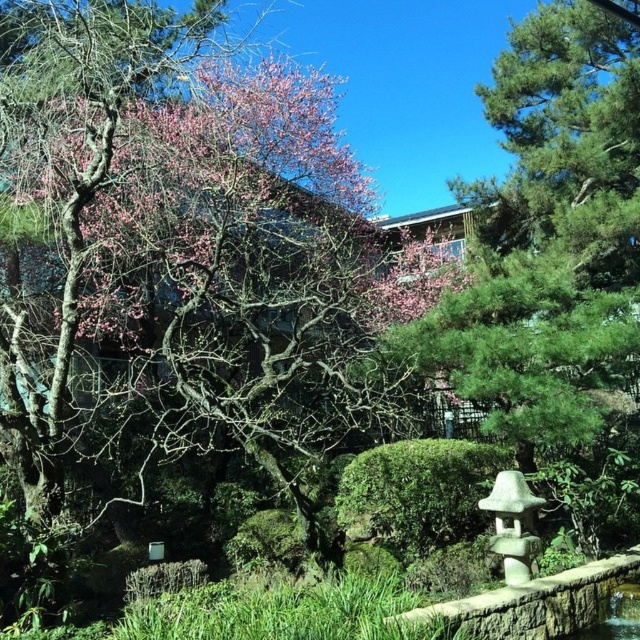
Question: Can you confirm if pink textured bark at upper left is positioned to the left of green textured pine tree at center?

Choices:
 (A) yes
 (B) no

Answer: (A)

Question: Among these points, which one is farthest from the camera?

Choices:
 (A) (529, 573)
 (B) (224, 10)

Answer: (B)

Question: Is green textured pine tree at center closer to the viewer compared to white stone lantern at lower right?

Choices:
 (A) no
 (B) yes

Answer: (A)

Question: Considering the real-world distances, which object is closest to the white stone lantern at lower right?

Choices:
 (A) green textured pine tree at center
 (B) pink textured bark at upper left

Answer: (A)

Question: Which point is closer to the camera?

Choices:
 (A) (484, 292)
 (B) (192, 193)
 (C) (516, 506)

Answer: (C)

Question: Is pink textured bark at upper left wider than green textured pine tree at center?

Choices:
 (A) yes
 (B) no

Answer: (A)